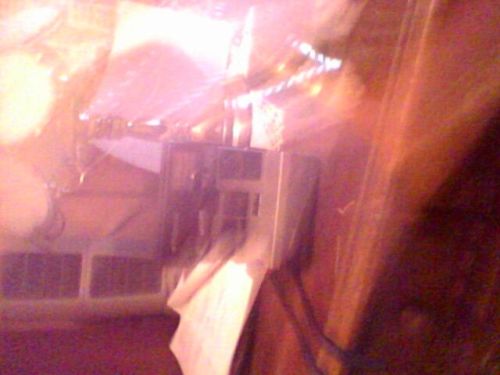
This screenshot has width=500, height=375. I want to click on lamp, so click(x=154, y=127).